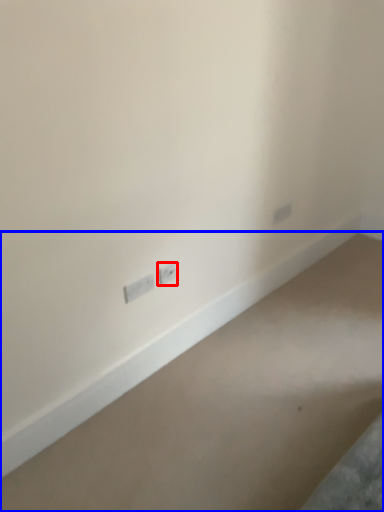
Question: Which object is further to the camera taking this photo, power plugs and sockets (highlighted by a red box) or concrete (highlighted by a blue box)?

Choices:
 (A) power plugs and sockets
 (B) concrete

Answer: (A)